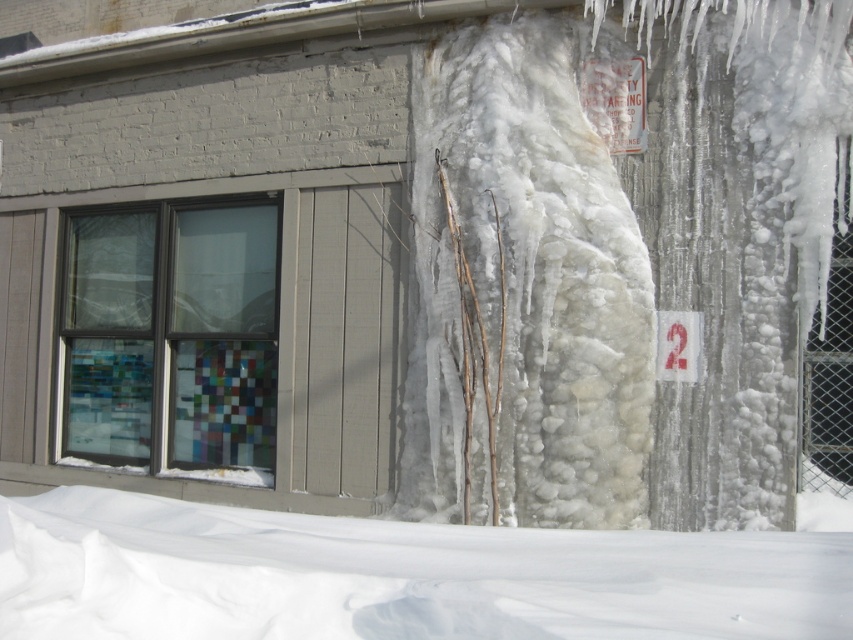
You are standing in front of the building and notice the translucent ice at center. Can you determine its exact position relative to the window?

The translucent ice at center is located at point 0.455 on the horizontal axis and 0.617 on the vertical axis relative to the window.

You are a maintenance worker assessing the building exterior. You need to clear the translucent ice at center and the white fluffy snow at lower center. Considering their distance apart, can you estimate if they are within a 10 feet safety zone for safe removal without equipment?

The translucent ice at center and white fluffy snow at lower center are 11.35 feet apart, which exceeds the 10 feet safety zone. Therefore, they are not within the required distance for safe removal without equipment.

You are standing in front of the building and looking at the two points marked on the image. Which point is closer to you, point (x=572, y=275) or point (x=637, y=541)?

Point (x=637, y=541) is closer to you because point (x=572, y=275) is behind it.